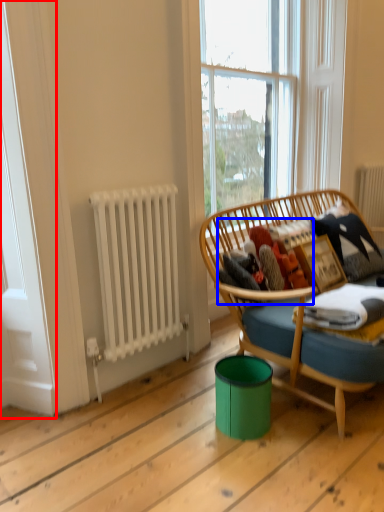
Question: Which of the following is the closest to the observer, screen door (highlighted by a red box) or clothing (highlighted by a blue box)?

Choices:
 (A) screen door
 (B) clothing

Answer: (A)